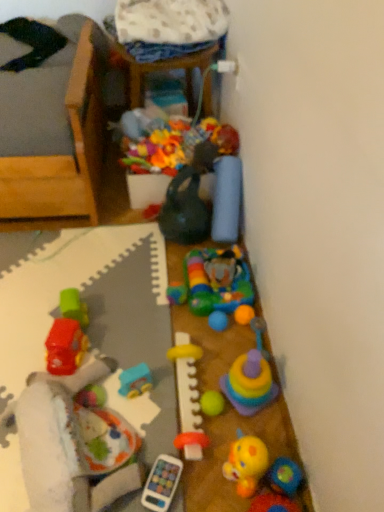
The height and width of the screenshot is (512, 384). What are the coordinates of `free space underneath rubberized plastic baby rattle at lower left, arranged as the first toy when viewed from the left (from a real-world perspective)` in the screenshot? It's located at (89, 423).